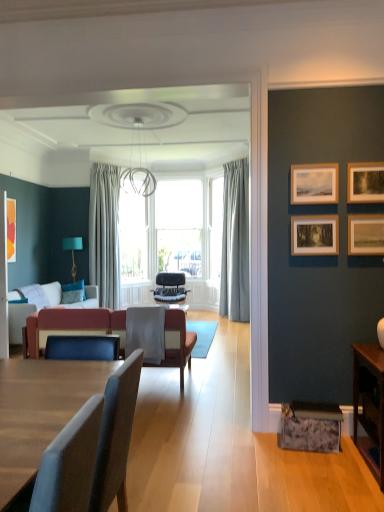
What do you see at coordinates (105, 233) in the screenshot?
I see `light gray sheer curtain at center, marked as the 1th curtain in a left-to-right arrangement` at bounding box center [105, 233].

Locate an element on the screen. wooden picture frame at right, which is the first picture frame in right-to-left order is located at coordinates (366, 234).

What is the approximate width of gray fabric curtain at center, placed as the first curtain when sorted from right to left?

17.19 inches.

Identify the location of transparent glass window at center. (179, 226).

What do you see at coordinates (92, 450) in the screenshot? The height and width of the screenshot is (512, 384). I see `fabric cushioned chair at center, placed as the second chair when sorted from back to front` at bounding box center [92, 450].

This screenshot has width=384, height=512. In order to click on light gray sheer curtain at center, which is the 2th curtain in right-to-left order in this screenshot , I will do `click(105, 233)`.

Can you confirm if fabric cushioned chair at center, placed as the second chair when sorted from back to front, is smaller than wooden picture frame at upper right, the first picture frame in the front-to-back sequence?

Actually, fabric cushioned chair at center, placed as the second chair when sorted from back to front, might be larger than wooden picture frame at upper right, the first picture frame in the front-to-back sequence.

From the image's perspective, between fabric cushioned chair at center, placed as the second chair when sorted from back to front, and wooden picture frame at upper right, the first picture frame in the front-to-back sequence, which one is located above?

wooden picture frame at upper right, the first picture frame in the front-to-back sequence, appears higher in the image.

Considering the points (101, 437) and (370, 197), which point is in front, point (101, 437) or point (370, 197)?

The point (101, 437) is closer to the camera.

Considering the relative sizes of wooden picture frame at upper right, acting as the 2th picture frame starting from the right, and velvet red couch at center in the image provided, is wooden picture frame at upper right, acting as the 2th picture frame starting from the right, shorter than velvet red couch at center?

Indeed, wooden picture frame at upper right, acting as the 2th picture frame starting from the right, has a lesser height compared to velvet red couch at center.

Considering the points (348, 170) and (175, 342), which point is in front, point (348, 170) or point (175, 342)?

Positioned in front is point (348, 170).

Between wooden picture frame at upper right, the first picture frame in the front-to-back sequence, and velvet red couch at center, which one has larger width?

With larger width is velvet red couch at center.

Is wooden picture frame at upper right, acting as the 2th picture frame starting from the right, aimed at velvet red couch at left?

No, wooden picture frame at upper right, acting as the 2th picture frame starting from the right, is not oriented towards velvet red couch at left.

Is wooden picture frame at upper right, the first picture frame in the front-to-back sequence, closer to camera compared to velvet red couch at left?

Yes, wooden picture frame at upper right, the first picture frame in the front-to-back sequence, is closer to the viewer.

From a real-world perspective, relative to velvet red couch at left, is wooden picture frame at upper right, acting as the 2th picture frame starting from the right, vertically above or below?

wooden picture frame at upper right, acting as the 2th picture frame starting from the right, is situated higher than velvet red couch at left in the real world.

Can you confirm if orange matte picture frame at left, marked as the 4th picture frame in a right-to-left arrangement, is shorter than gray fabric curtain at center, placed as the 2th curtain when sorted from left to right?

Indeed, orange matte picture frame at left, marked as the 4th picture frame in a right-to-left arrangement, has a lesser height compared to gray fabric curtain at center, placed as the 2th curtain when sorted from left to right.

Is orange matte picture frame at left, which is the fourth picture frame in front-to-back order, thinner than gray fabric curtain at center, placed as the 2th curtain when sorted from left to right?

Yes, orange matte picture frame at left, which is the fourth picture frame in front-to-back order, is thinner than gray fabric curtain at center, placed as the 2th curtain when sorted from left to right.

Which of these two, orange matte picture frame at left, which is the fourth picture frame in front-to-back order, or gray fabric curtain at center, placed as the first curtain when sorted from right to left, is smaller?

orange matte picture frame at left, which is the fourth picture frame in front-to-back order.

Does velvet red couch at left have a lesser height compared to light gray sheer curtain at center, which is the 2th curtain in right-to-left order?

Indeed, velvet red couch at left has a lesser height compared to light gray sheer curtain at center, which is the 2th curtain in right-to-left order.

Find the location of `studio couch lying below the light gray sheer curtain at center, which is the 2th curtain in right-to-left order (from the image's perspective)`. studio couch lying below the light gray sheer curtain at center, which is the 2th curtain in right-to-left order (from the image's perspective) is located at coordinates (73, 303).

Which is in front, point (9, 317) or point (115, 234)?

The point (9, 317) is closer.

In the scene shown: Is wooden picture frame at right, arranged as the 3th picture frame when viewed from the back, located outside wooden picture frame at upper right, which is the third picture frame in right-to-left order?

Absolutely, wooden picture frame at right, arranged as the 3th picture frame when viewed from the back, is external to wooden picture frame at upper right, which is the third picture frame in right-to-left order.

Considering the positions of objects wooden picture frame at right, which is the first picture frame in right-to-left order, and wooden picture frame at upper right, the second picture frame when ordered from left to right, in the image provided, who is more to the left, wooden picture frame at right, which is the first picture frame in right-to-left order, or wooden picture frame at upper right, the second picture frame when ordered from left to right,?

wooden picture frame at upper right, the second picture frame when ordered from left to right, is more to the left.

How many degrees apart are the facing directions of wooden picture frame at right, which is the first picture frame in right-to-left order, and wooden picture frame at upper right, which is the 3th picture frame from front to back?

0.00384 degrees separate the facing orientations of wooden picture frame at right, which is the first picture frame in right-to-left order, and wooden picture frame at upper right, which is the 3th picture frame from front to back.

Considering the relative sizes of wooden picture frame at right, which is the first picture frame in right-to-left order, and wooden picture frame at upper right, the 2th picture frame from the back, in the image provided, is wooden picture frame at right, which is the first picture frame in right-to-left order, smaller than wooden picture frame at upper right, the 2th picture frame from the back,?

Correct, wooden picture frame at right, which is the first picture frame in right-to-left order, occupies less space than wooden picture frame at upper right, the 2th picture frame from the back.

Is wooden table at lower right looking in the opposite direction of black leather chair at center, the 2th chair from the front?

No.

Is wooden table at lower right directly adjacent to black leather chair at center, the 2th chair from the front?

No, wooden table at lower right is not touching black leather chair at center, the 2th chair from the front.

In the image, is wooden table at lower right positioned in front of or behind black leather chair at center, the 2th chair from the front?

wooden table at lower right is in front of black leather chair at center, the 2th chair from the front.

Is wooden table at lower right thinner than black leather chair at center, the 1th chair positioned from the back?

Yes, wooden table at lower right is thinner than black leather chair at center, the 1th chair positioned from the back.

Where is `the 2nd chair to the left of the wooden picture frame at upper right, the third picture frame when ordered from left to right, counting from the anchor's position`? the 2nd chair to the left of the wooden picture frame at upper right, the third picture frame when ordered from left to right, counting from the anchor's position is located at coordinates (92, 450).

From the image's perspective, which picture frame is the 4th one above the velvet red couch at center? Please provide its 2D coordinates.

[(365, 182)]

Based on their spatial positions, is transparent glass window at center or wooden picture frame at upper right, the third picture frame when ordered from left to right, closer to orange matte picture frame at left, marked as the 4th picture frame in a right-to-left arrangement?

transparent glass window at center is positioned closer to the anchor orange matte picture frame at left, marked as the 4th picture frame in a right-to-left arrangement.

Based on their spatial positions, is transparent glass window at center or velvet red couch at left further from wooden picture frame at upper right, the 2th picture frame from the back?

Among the two, transparent glass window at center is located further to wooden picture frame at upper right, the 2th picture frame from the back.

Based on their spatial positions, is wooden picture frame at upper right, which is the 3th picture frame from front to back, or fabric cushioned chair at center, placed as the second chair when sorted from back to front, closer to wooden picture frame at upper right, positioned as the 4th picture frame in back-to-front order?

Based on the image, wooden picture frame at upper right, which is the 3th picture frame from front to back, appears to be nearer to wooden picture frame at upper right, positioned as the 4th picture frame in back-to-front order.

Looking at the image, which one is located further to transparent glass window at center, gray fabric curtain at center, placed as the 2th curtain when sorted from left to right, or velvet red couch at center?

velvet red couch at center lies further to transparent glass window at center than the other object.

From the image, which object appears to be farther from wooden picture frame at right, which is the first picture frame in right-to-left order, fabric cushioned chair at center, arranged as the first chair when viewed from the front, or gray fabric curtain at center, placed as the first curtain when sorted from right to left?

gray fabric curtain at center, placed as the first curtain when sorted from right to left.

From the picture: Considering their positions, is wooden picture frame at upper right, which is the third picture frame in right-to-left order, positioned closer to orange matte picture frame at left, the 1th picture frame when ordered from back to front, than teal fabric lampshade at left?

teal fabric lampshade at left lies closer to orange matte picture frame at left, the 1th picture frame when ordered from back to front, than the other object.

Looking at the image, which one is located further to light gray sheer curtain at center, marked as the 1th curtain in a left-to-right arrangement, transparent glass window at center or black leather chair at center, the 1th chair positioned from the back?

Among the two, black leather chair at center, the 1th chair positioned from the back, is located further to light gray sheer curtain at center, marked as the 1th curtain in a left-to-right arrangement.

Based on the photo, looking at the image, which one is located closer to wooden picture frame at right, the 2th picture frame positioned from the front, teal fabric lampshade at left or gray fabric curtain at center, placed as the 2th curtain when sorted from left to right?

gray fabric curtain at center, placed as the 2th curtain when sorted from left to right.

Locate an element on the screen. This screenshot has height=512, width=384. lamp between velvet red couch at left and transparent glass window at center from front to back is located at coordinates (73, 251).

You are a GUI agent. You are given a task and a screenshot of the screen. Output one action in this format:
    pyautogui.click(x=<x>, y=<y>)
    Task: Click on the couch between wooden picture frame at upper right, the first picture frame in the front-to-back sequence, and black leather chair at center, the 2th chair from the front, in the front-back direction
    
    Given the screenshot: What is the action you would take?
    pyautogui.click(x=72, y=325)

Where is `couch between wooden picture frame at upper right, the third picture frame when ordered from left to right, and light gray sheer curtain at center, which is the 2th curtain in right-to-left order, along the z-axis`? The width and height of the screenshot is (384, 512). couch between wooden picture frame at upper right, the third picture frame when ordered from left to right, and light gray sheer curtain at center, which is the 2th curtain in right-to-left order, along the z-axis is located at coordinates (72, 325).

Where is `studio couch between velvet red couch at center and gray fabric curtain at center, placed as the 2th curtain when sorted from left to right, in the front-back direction`? The height and width of the screenshot is (512, 384). studio couch between velvet red couch at center and gray fabric curtain at center, placed as the 2th curtain when sorted from left to right, in the front-back direction is located at coordinates (73, 303).